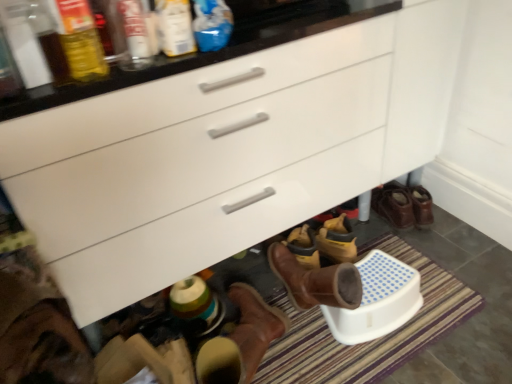
Question: From the image's perspective, is matte glass bottle at upper left, which ranks as the fourth bottle in right-to-left order, positioned above or below translucent plastic bottle at upper left, which appears as the second bottle when viewed from the left?

Choices:
 (A) below
 (B) above

Answer: (A)

Question: Is matte glass bottle at upper left, which ranks as the fourth bottle in right-to-left order, taller or shorter than translucent plastic bottle at upper left, the third bottle from the right?

Choices:
 (A) tall
 (B) short

Answer: (B)

Question: Which of these objects is positioned closest to the striped carpet at lower center?

Choices:
 (A) matte plastic bottle at upper center, positioned as the second bottle in right-to-left order
 (B) blue plastic bottle at upper center, which appears as the first bottle when viewed from the right
 (C) matte glass bottle at upper left, which ranks as the fourth bottle in right-to-left order
 (D) translucent plastic bottle at upper left, the third bottle from the right
 (E) brown leather boots at lower right

Answer: (E)

Question: Which is farther from the blue plastic bottle at upper center, the fourth bottle in the left-to-right sequence?

Choices:
 (A) striped carpet at lower center
 (B) translucent plastic bottle at upper left, the third bottle from the right
 (C) matte plastic bottle at upper center, positioned as the second bottle in right-to-left order
 (D) matte glass bottle at upper left, which ranks as the fourth bottle in right-to-left order
 (E) brown leather boots at lower right

Answer: (E)